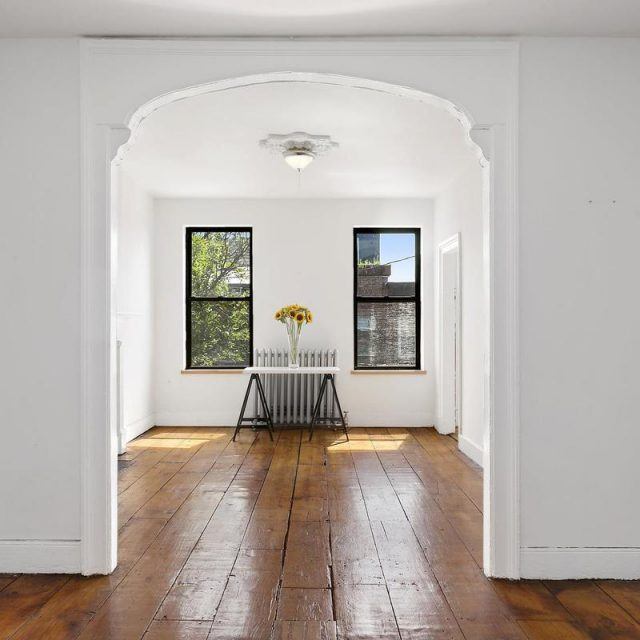
Where is `white table top`? The height and width of the screenshot is (640, 640). white table top is located at coordinates (274, 368).